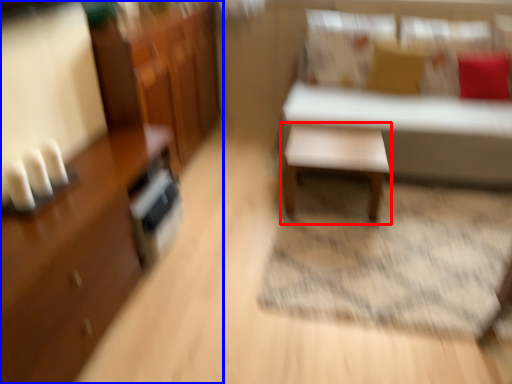
Question: Among these objects, which one is nearest to the camera, table (highlighted by a red box) or cabinetry (highlighted by a blue box)?

Choices:
 (A) table
 (B) cabinetry

Answer: (B)